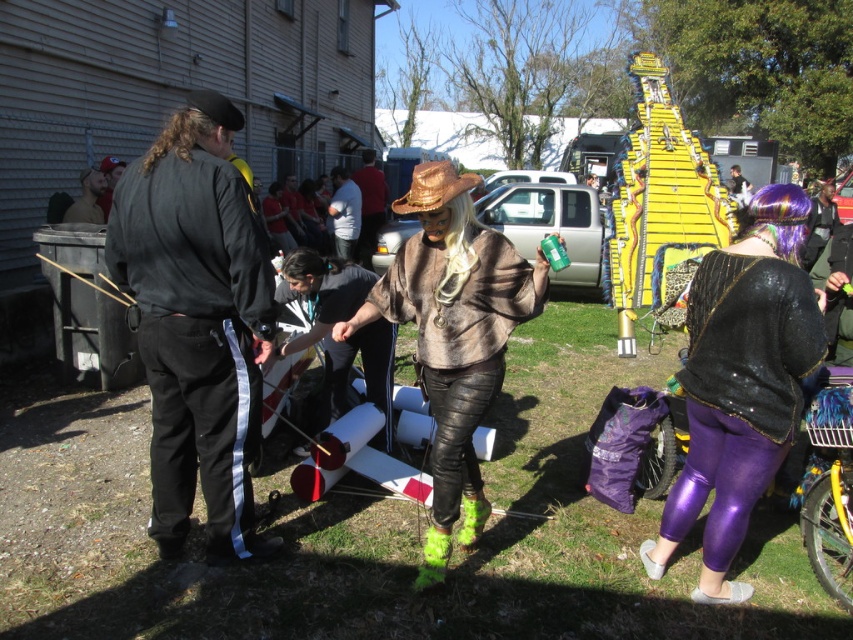
Question: Estimate the real-world distances between objects in this image. Which object is closer to the brushed metal drum at center?

Choices:
 (A) matte brown fur coat at center
 (B) brushed metal can at center

Answer: (A)

Question: Which object is closer to the camera taking this photo?

Choices:
 (A) leather pants at center
 (B) matte black jacket at upper left

Answer: (A)

Question: Does metallic purple leggings at lower right lie in front of leather pants at center?

Choices:
 (A) no
 (B) yes

Answer: (B)

Question: Is black fabric pants at left to the left of brushed metal drum at center from the viewer's perspective?

Choices:
 (A) yes
 (B) no

Answer: (A)

Question: Is black fabric pants at left to the right of leather pants at center from the viewer's perspective?

Choices:
 (A) no
 (B) yes

Answer: (A)

Question: Estimate the real-world distances between objects in this image. Which object is closer to the red shirt at center?

Choices:
 (A) leather pants at center
 (B) brushed metal can at center
 (C) brushed metal drum at center
 (D) matte brown fur coat at center

Answer: (D)